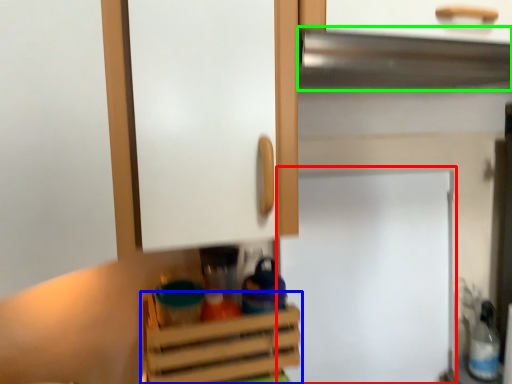
Question: Estimate the real-world distances between objects in this image. Which object is closer to fridge (highlighted by a red box), cabinetry (highlighted by a blue box) or exhaust hood (highlighted by a green box)?

Choices:
 (A) cabinetry
 (B) exhaust hood

Answer: (A)